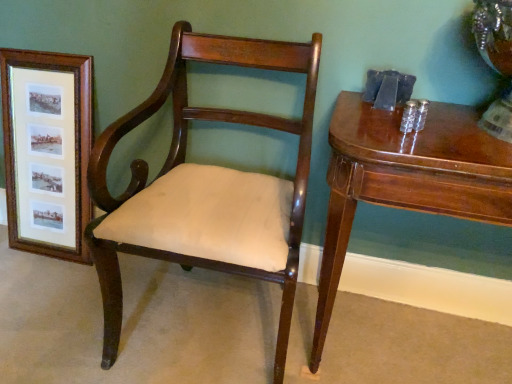
At what (x,y) coordinates should I click in order to perform the action: click on vacant area situated to the left side of mahogany wood chair at center. Please return your answer as a coordinate pair (x, y). The width and height of the screenshot is (512, 384). Looking at the image, I should click on (70, 310).